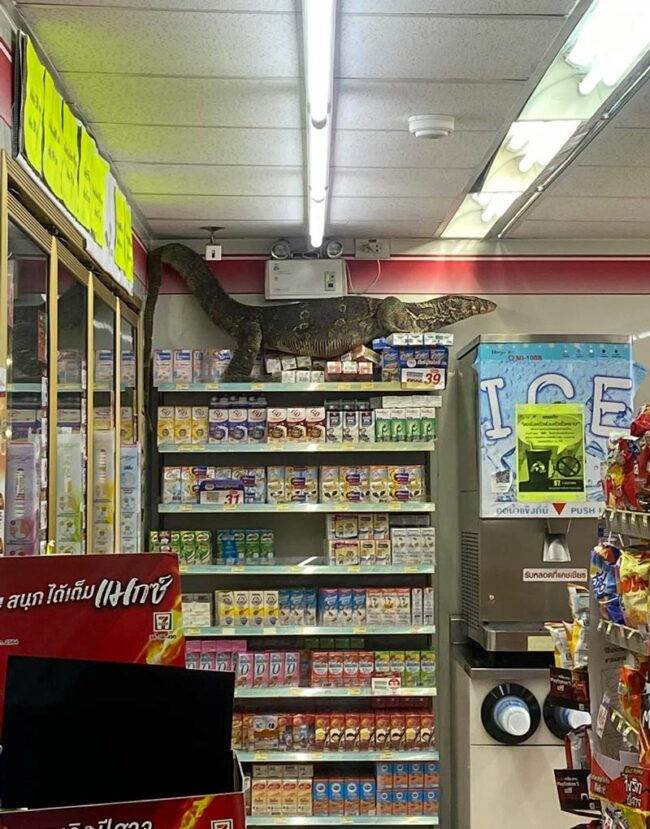
In order to click on fluorescent light in this screenshot , I will do `click(320, 52)`, `click(320, 162)`, `click(316, 226)`, `click(618, 46)`, `click(536, 141)`, `click(478, 221)`.